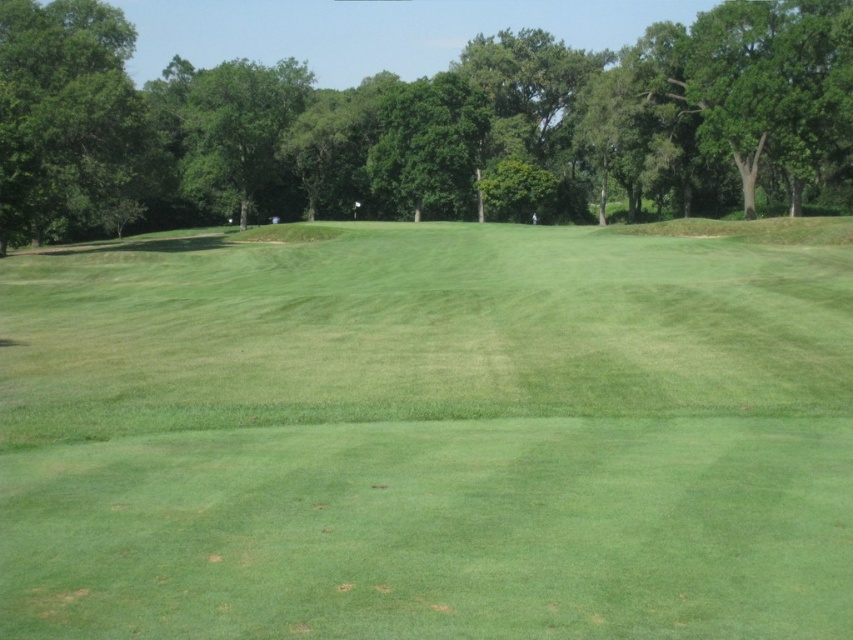
What do you see at coordinates (425, 436) in the screenshot? I see `green grassy field at center` at bounding box center [425, 436].

Identify the location of green grassy field at center. Image resolution: width=853 pixels, height=640 pixels. (425, 436).

Who is lower down, green grassy field at center or green leafy tree at left?

green grassy field at center is lower down.

Locate an element on the screen. The height and width of the screenshot is (640, 853). green grassy field at center is located at coordinates (425, 436).

The image size is (853, 640). What do you see at coordinates (425, 436) in the screenshot?
I see `green grassy field at center` at bounding box center [425, 436].

At what (x,y) coordinates should I click in order to perform the action: click on green grassy field at center. Please return your answer as a coordinate pair (x, y). This screenshot has height=640, width=853. Looking at the image, I should click on (425, 436).

Between green leafy tree at upper center and green leafy tree at left, which one has more height?

green leafy tree at upper center is taller.

Is point (691, 113) in front of point (28, 112)?

No, it is not.

At what (x,y) coordinates should I click in order to perform the action: click on green leafy tree at upper center. Please return your answer as a coordinate pair (x, y). Looking at the image, I should click on (422, 125).